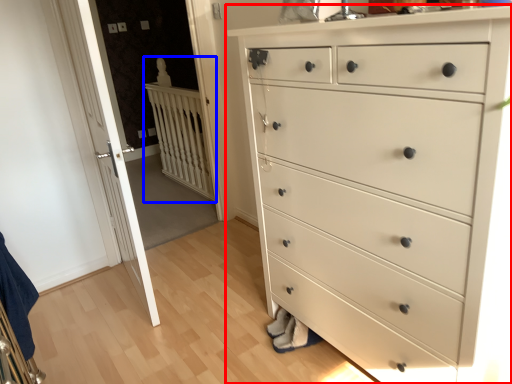
Question: Which object is further to the camera taking this photo, chest of drawers (highlighted by a red box) or balustrade (highlighted by a blue box)?

Choices:
 (A) chest of drawers
 (B) balustrade

Answer: (B)